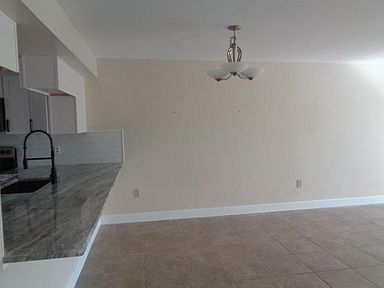
Find the location of a particular element. The width and height of the screenshot is (384, 288). wall trim is located at coordinates (184, 213).